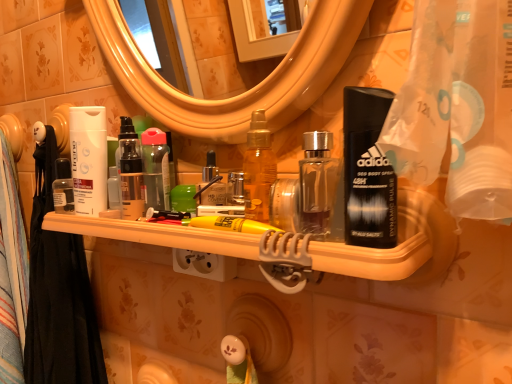
Question: Is glossy plastic mirror at upper center situated inside transparent plastic bottle at center or outside?

Choices:
 (A) outside
 (B) inside

Answer: (A)

Question: Is glossy plastic mirror at upper center wider or thinner than transparent plastic bottle at center?

Choices:
 (A) wide
 (B) thin

Answer: (A)

Question: Which of these objects is positioned closest to the transparent plastic bottle at center?

Choices:
 (A) black fabric shower curtain at left
 (B) matte black lotion at center
 (C) glossy plastic mirror at upper center
 (D) translucent plastic shelf at center
 (E) white matte lotion at left

Answer: (B)

Question: Which object is the farthest from the glossy plastic mirror at upper center?

Choices:
 (A) transparent plastic bottle at center
 (B) black fabric shower curtain at left
 (C) matte black lotion at center
 (D) translucent plastic shelf at center
 (E) white matte lotion at left

Answer: (B)